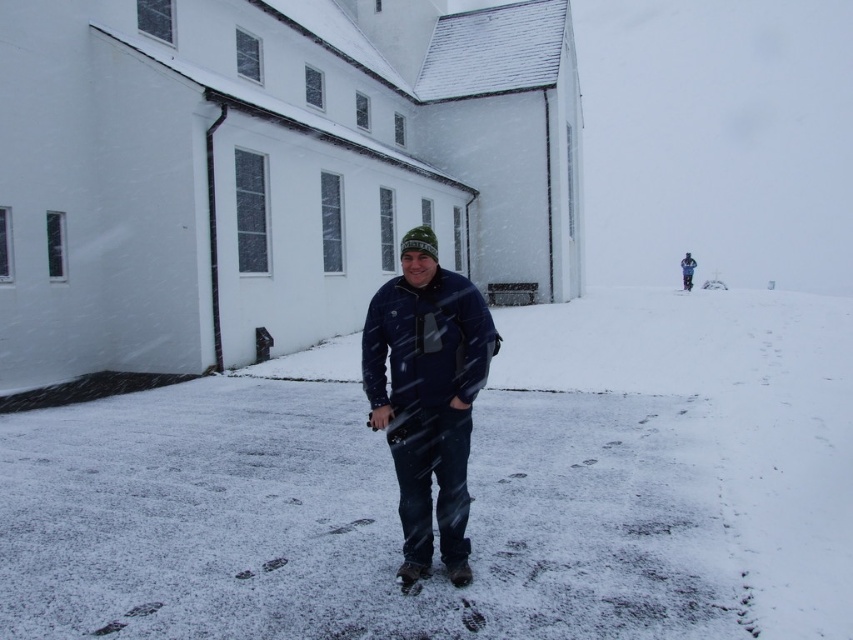
Is white powdery snow at center shorter than dark blue jacket at center?

Incorrect, white powdery snow at center's height does not fall short of dark blue jacket at center's.

This screenshot has width=853, height=640. What do you see at coordinates (666, 467) in the screenshot?
I see `white powdery snow at center` at bounding box center [666, 467].

Locate an element on the screen. The image size is (853, 640). white powdery snow at center is located at coordinates (666, 467).